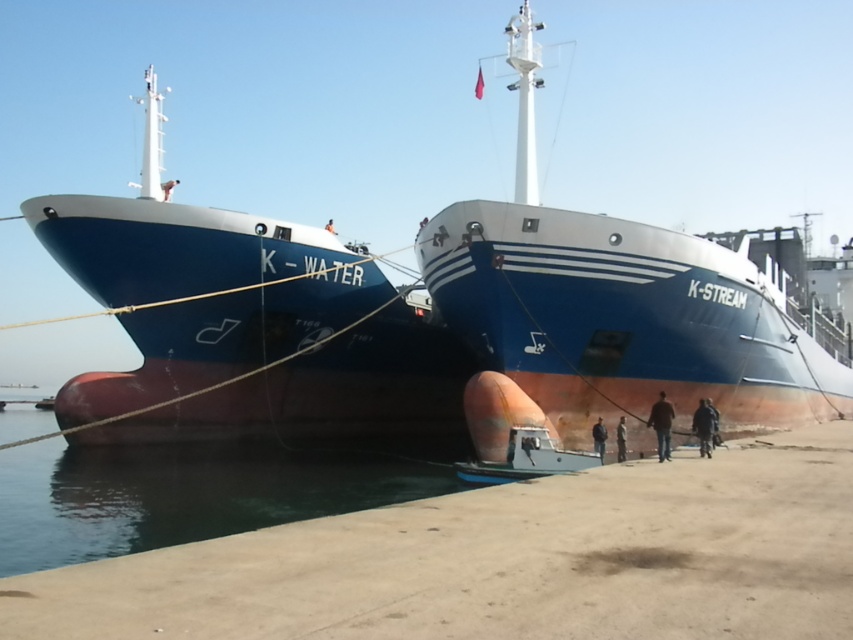
Question: Based on their relative distances, which object is farther from the brown leather jacket at lower center?

Choices:
 (A) dark blue leather jacket at lower center
 (B) dark brown water at lower center

Answer: (B)

Question: Is dark brown water at lower center above dark blue fabric jacket at lower right?

Choices:
 (A) yes
 (B) no

Answer: (B)

Question: Where is blue matte ship at left located in relation to dark blue fabric jacket at lower right in the image?

Choices:
 (A) below
 (B) above

Answer: (B)

Question: Estimate the real-world distances between objects in this image. Which object is closer to the rustic metal ship at center?

Choices:
 (A) dark blue leather jacket at lower center
 (B) dark brown water at lower center
 (C) brown leather jacket at lower center
 (D) dark blue fabric jacket at lower right

Answer: (B)

Question: Which object is positioned farthest from the dark blue leather jacket at lower center?

Choices:
 (A) dark gray fabric jacket at lower center
 (B) dark brown water at lower center
 (C) rustic metal ship at center

Answer: (C)

Question: Can you confirm if dark blue fabric jacket at lower right is bigger than dark gray fabric jacket at lower center?

Choices:
 (A) no
 (B) yes

Answer: (B)